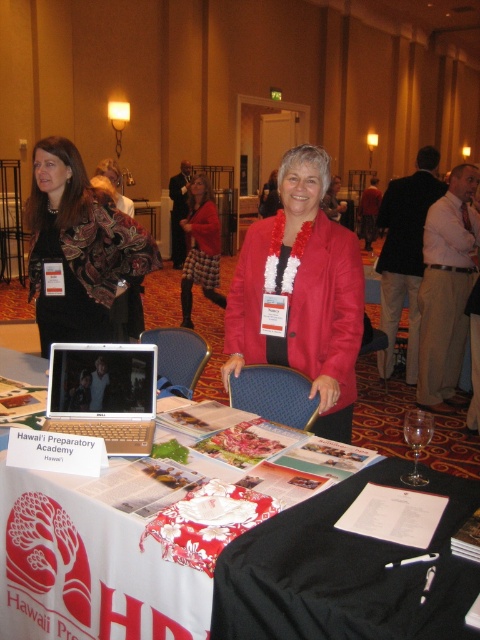
What is located at the coordinates point (87, 566) in the image?

The point (87, 566) marks the location of the white paper at center.

You are attending a career fair and want to know which object is taller between the matte black scarf at upper left and the silver metallic laptop at center. Can you tell me?

The matte black scarf at upper left has a greater height compared to the silver metallic laptop at center, so the matte black scarf at upper left is taller.